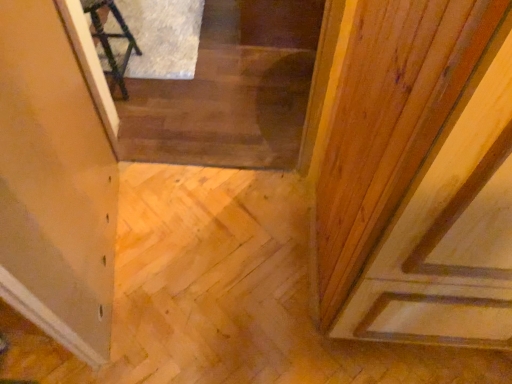
Locate an element on the screen. The image size is (512, 384). free spot below transparent glass door at upper left (from a real-world perspective) is located at coordinates (120, 258).